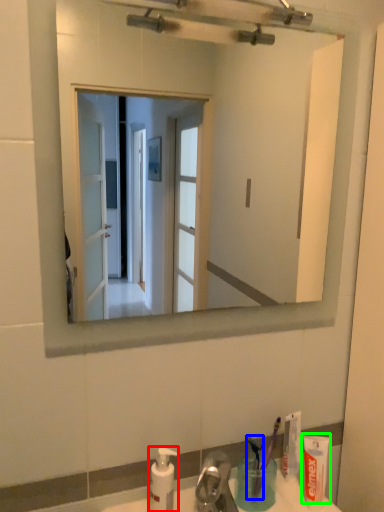
Question: Estimate the real-world distances between objects in this image. Which object is closer to soap dispenser (highlighted by a red box), toothbrush (highlighted by a blue box) or toothpaste (highlighted by a green box)?

Choices:
 (A) toothbrush
 (B) toothpaste

Answer: (A)